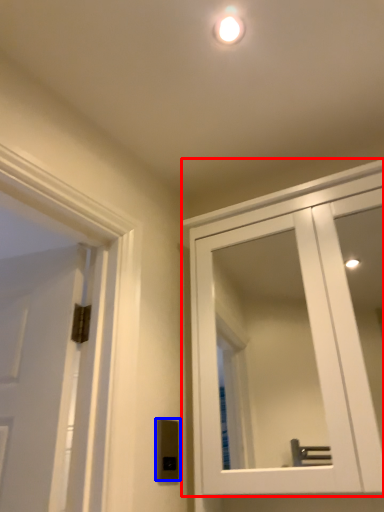
Question: Which object appears farthest to the camera in this image, cabinetry (highlighted by a red box) or light switch (highlighted by a blue box)?

Choices:
 (A) cabinetry
 (B) light switch

Answer: (B)